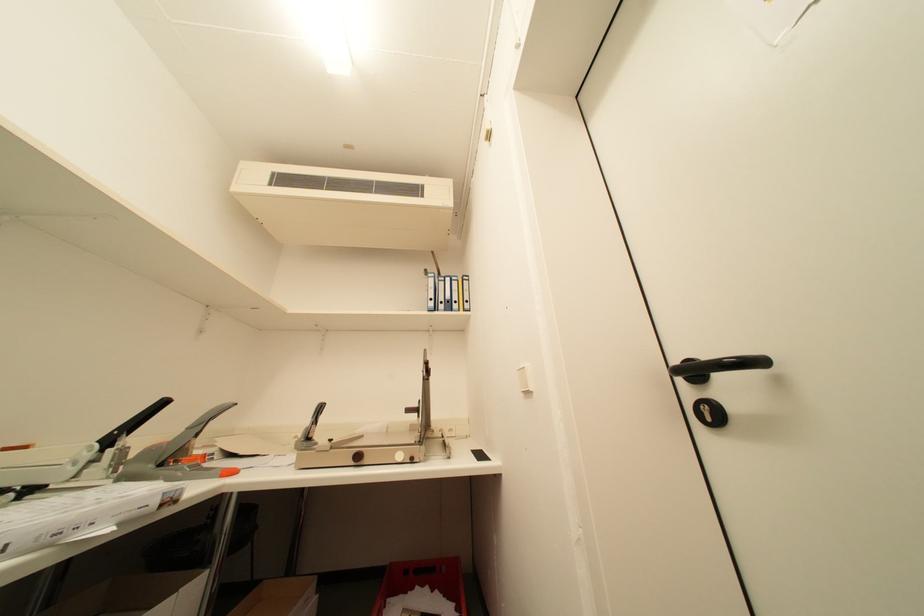
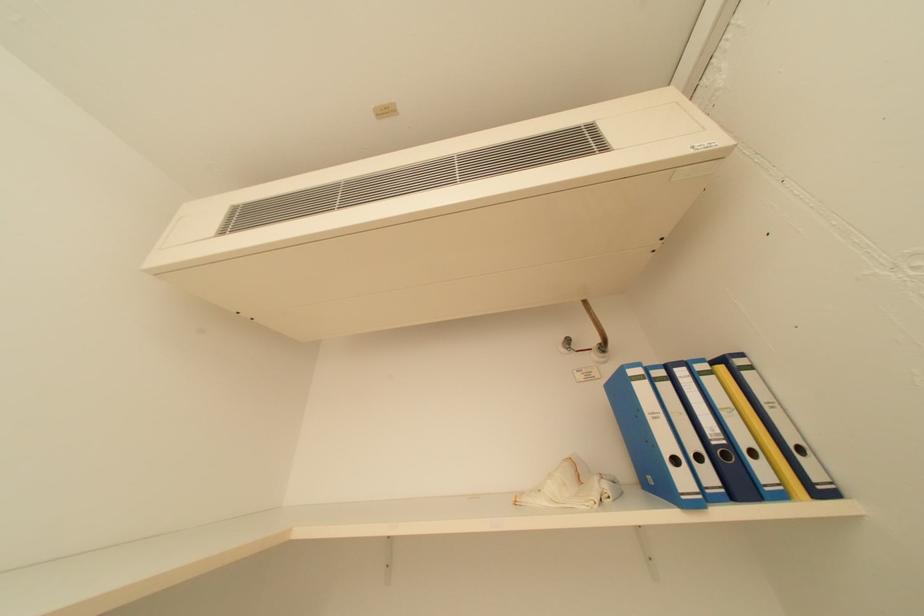
Which direction would the cameraman need to move to produce the second image?

The movement direction of the cameraman is left, forward.